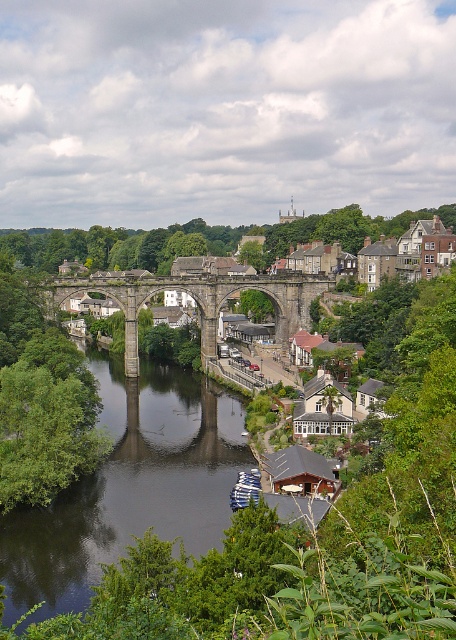
The height and width of the screenshot is (640, 456). What do you see at coordinates (129, 484) in the screenshot?
I see `dark reflective water at center` at bounding box center [129, 484].

Consider the image. Does dark reflective water at center appear on the left side of stone arch bridge at center?

In fact, dark reflective water at center is to the right of stone arch bridge at center.

Measure the distance between dark reflective water at center and camera.

A distance of 85.05 meters exists between dark reflective water at center and camera.

The height and width of the screenshot is (640, 456). Find the location of `dark reflective water at center`. dark reflective water at center is located at coordinates (129, 484).